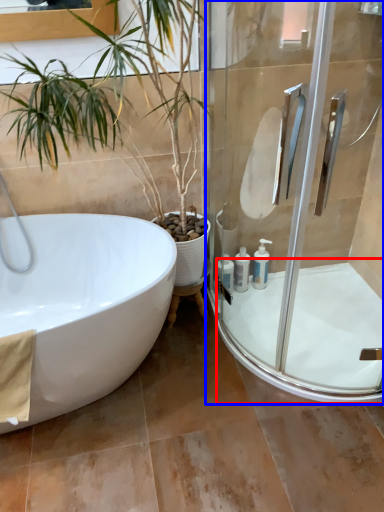
Question: Among these objects, which one is nearest to the camera, bath (highlighted by a red box) or shower door (highlighted by a blue box)?

Choices:
 (A) bath
 (B) shower door

Answer: (B)